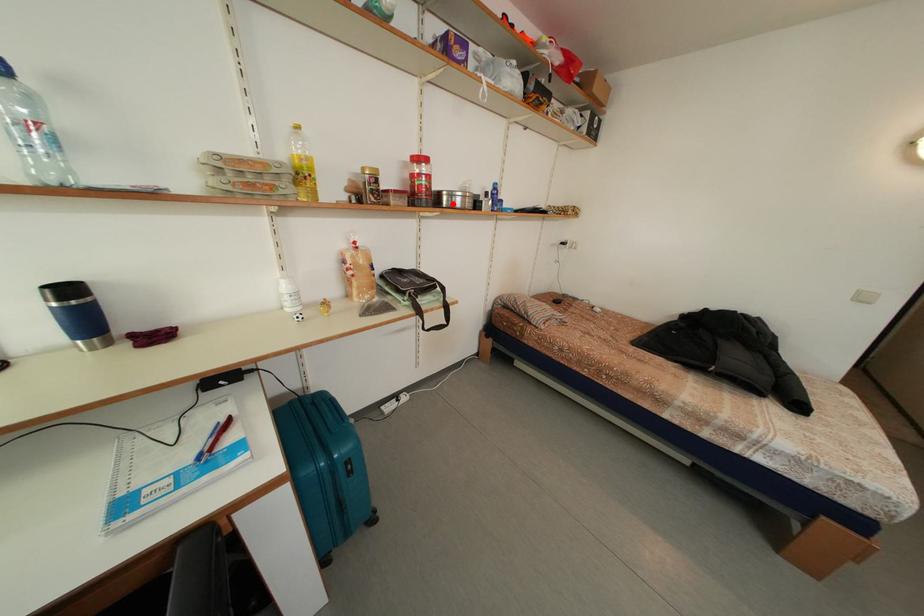
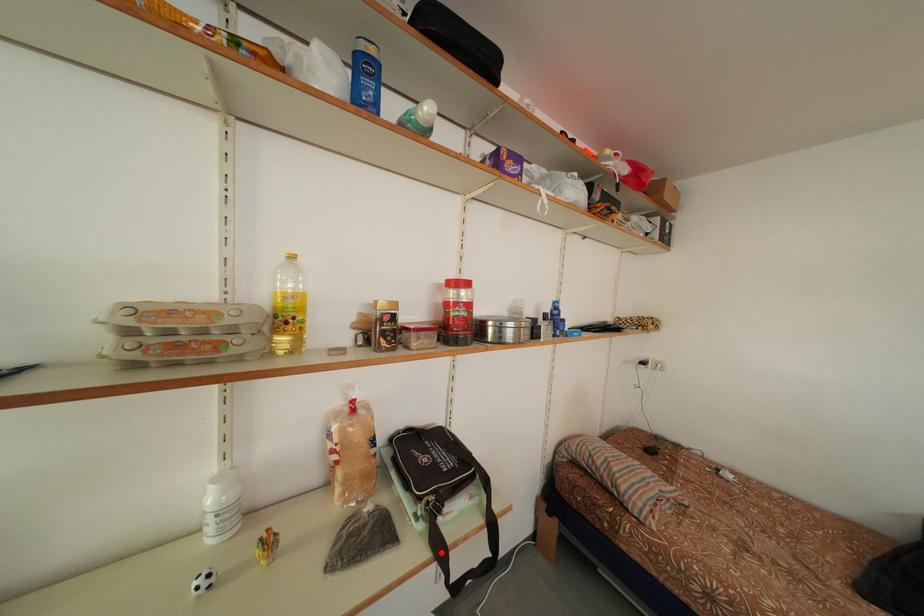
I am providing you with two images of the same scene from different viewpoints. A red point is marked on the first image and another point is marked on the second image. Do the highlighted points in image1 and image2 indicate the same real-world spot?

No